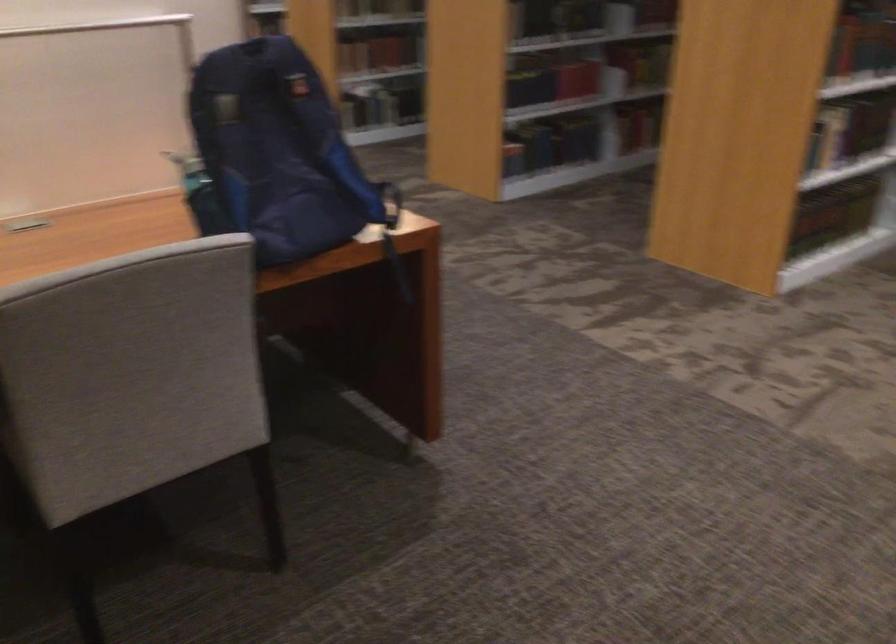
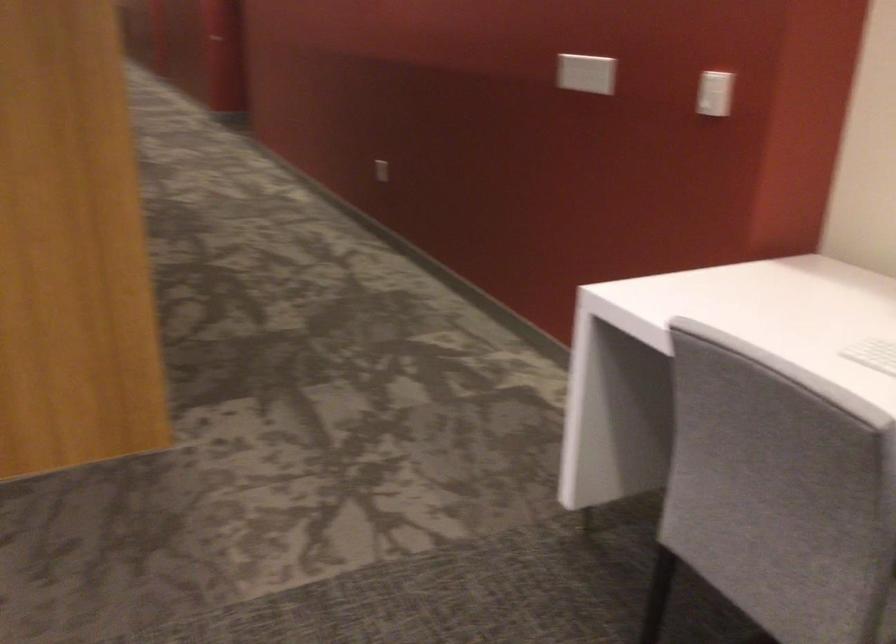
Question: How did the camera likely rotate?

Choices:
 (A) Left
 (B) Right
 (C) Up
 (D) Down

Answer: (B)